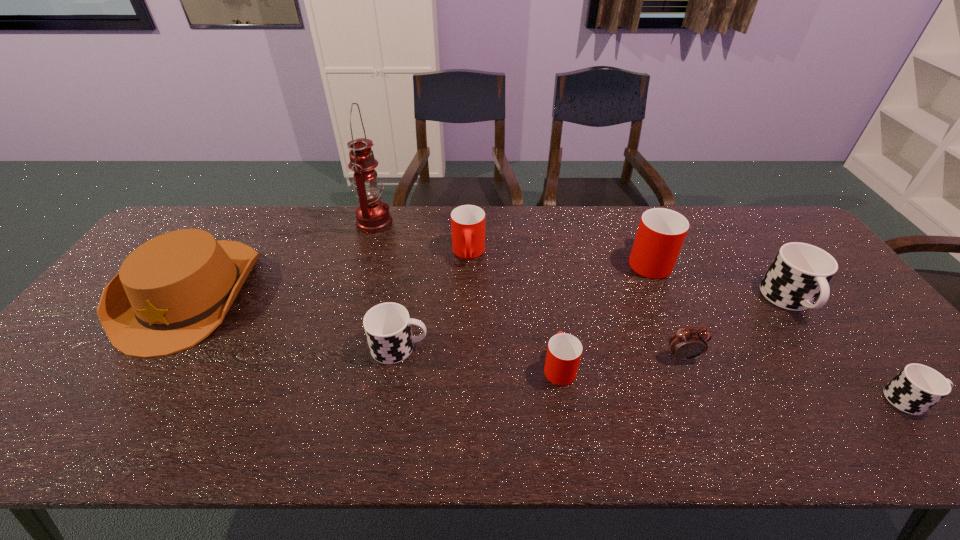
Where is `object that is at the near edge`? object that is at the near edge is located at coordinates pyautogui.click(x=916, y=388).

Locate an element on the screen. The height and width of the screenshot is (540, 960). object located in the left edge section of the desktop is located at coordinates (173, 291).

Where is `object at the far left corner`? object at the far left corner is located at coordinates (173, 291).

Where is `object located at the near right corner`? This screenshot has height=540, width=960. object located at the near right corner is located at coordinates (916, 388).

Where is `free space at the far edge of the desktop`? This screenshot has width=960, height=540. free space at the far edge of the desktop is located at coordinates (236, 214).

Find the location of a particular element. The image size is (960, 540). free space at the near edge of the desktop is located at coordinates (82, 450).

Where is `free region at the right edge of the desktop`? free region at the right edge of the desktop is located at coordinates (880, 331).

Find the location of a particular element. free point between the second smallest red cup and the nearest black cup is located at coordinates (689, 326).

You are a GUI agent. You are given a task and a screenshot of the screen. Output one action in this format:
    pyautogui.click(x=<x>, y=<y>)
    Task: Click on the vacant region between the second biggest black cup and the third cup from left to right
    The height and width of the screenshot is (540, 960).
    Given the screenshot: What is the action you would take?
    pyautogui.click(x=479, y=357)

Locate an element on the screen. This screenshot has width=960, height=540. vacant point located between the sixth object from right to left and the second nearest black cup is located at coordinates (434, 300).